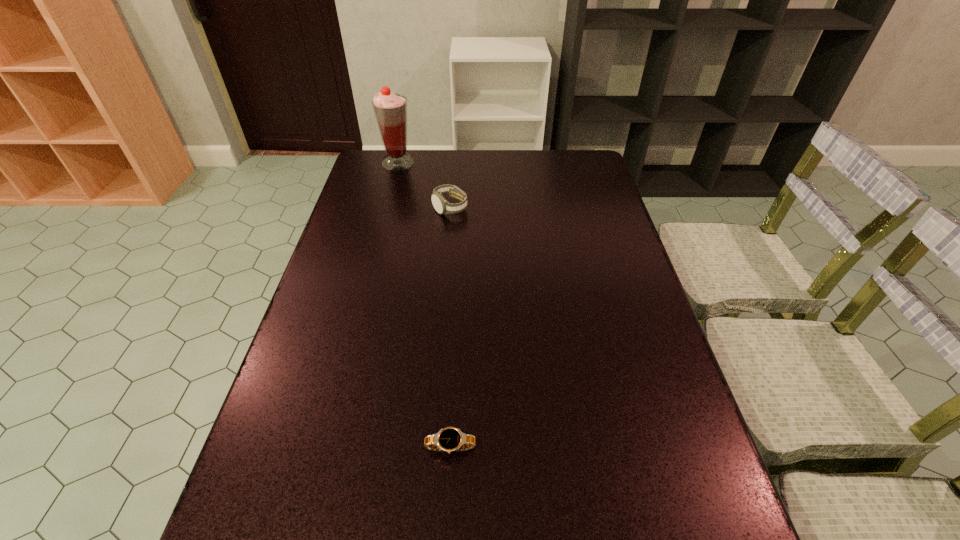
You are a GUI agent. You are given a task and a screenshot of the screen. Output one action in this format:
    pyautogui.click(x=<x>, y=<y>)
    Task: Click on the object that is at the left edge
    This screenshot has width=960, height=540.
    Given the screenshot: What is the action you would take?
    pyautogui.click(x=390, y=109)

The image size is (960, 540). Identify the location of object present at the far left corner. tap(390, 109).

The height and width of the screenshot is (540, 960). What are the coordinates of `vacant region at the far edge of the desktop` in the screenshot? It's located at (510, 164).

This screenshot has height=540, width=960. In the image, there is a desktop. Find the location of `vacant region at the left edge`. vacant region at the left edge is located at coordinates (362, 186).

You are a GUI agent. You are given a task and a screenshot of the screen. Output one action in this format:
    pyautogui.click(x=<x>, y=<y>)
    Task: Click on the vacant region at the right edge of the desktop
    This screenshot has height=540, width=960.
    Given the screenshot: What is the action you would take?
    pyautogui.click(x=569, y=200)

The height and width of the screenshot is (540, 960). I want to click on free space at the far left corner of the desktop, so click(361, 174).

Where is `vacant space at the far right corner of the desktop`? vacant space at the far right corner of the desktop is located at coordinates (560, 178).

This screenshot has width=960, height=540. I want to click on vacant space that is in between the smoothie and the second tallest object, so click(424, 185).

Image resolution: width=960 pixels, height=540 pixels. Identify the location of vacant space that is in between the shortest object and the second nearest object. (450, 328).

This screenshot has width=960, height=540. Identify the location of empty location between the farthest object and the taller watch. (424, 185).